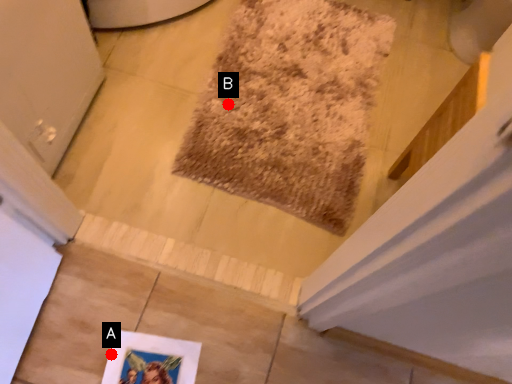
Question: Two points are circled on the image, labeled by A and B beside each circle. Which point is further to the camera?

Choices:
 (A) A is further
 (B) B is further

Answer: (B)